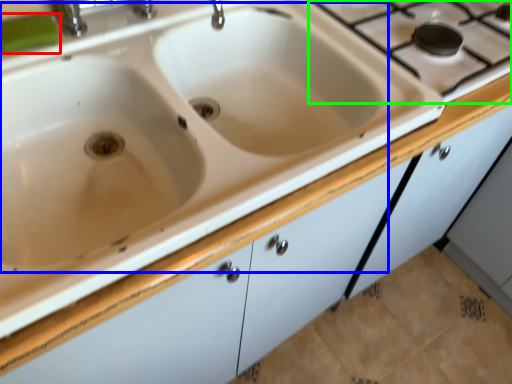
Question: Which object is the farthest from soap (highlighted by a red box)? Choose among these: sink (highlighted by a blue box) or gas stove (highlighted by a green box).

Choices:
 (A) sink
 (B) gas stove

Answer: (B)